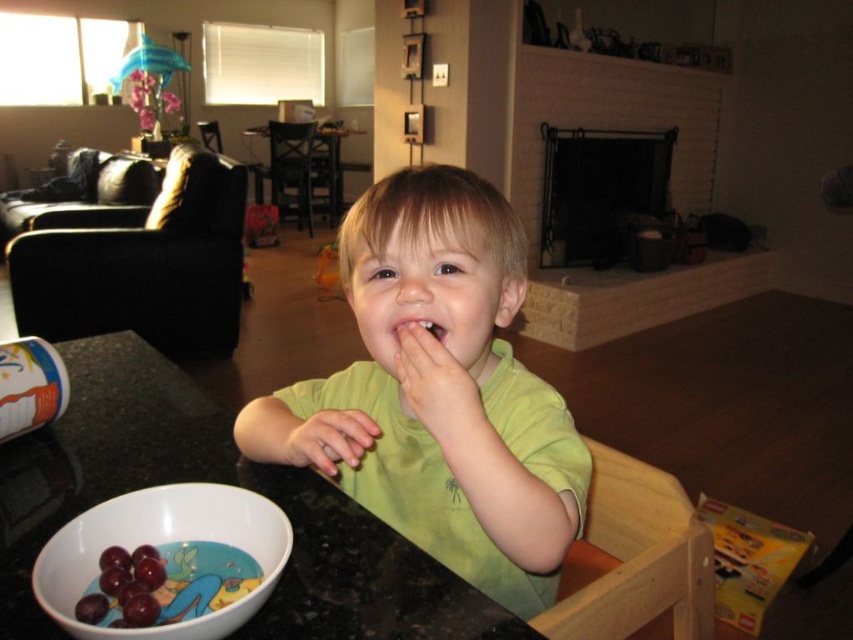
Question: Can you confirm if black granite table at lower left is positioned below smooth skin at mouth right?

Choices:
 (A) no
 (B) yes

Answer: (B)

Question: Which point is closer to the camera?

Choices:
 (A) black granite table at lower left
 (B) black fabric couch at left
 (C) smooth skin at mouth right
 (D) green matte shirt at center

Answer: (A)

Question: Which is farther from the black fabric couch at left?

Choices:
 (A) green matte shirt at center
 (B) black granite table at lower left
 (C) wooden table at center
 (D) smooth skin at mouth right

Answer: (C)

Question: Which point is closer to the camera taking this photo?

Choices:
 (A) (103, 598)
 (B) (471, 368)
 (C) (357, 580)

Answer: (A)

Question: Can you confirm if black fabric couch at left is positioned above wooden table at center?

Choices:
 (A) yes
 (B) no

Answer: (B)

Question: Is green matte shirt at center closer to the viewer compared to matte white bowl at lower left?

Choices:
 (A) yes
 (B) no

Answer: (B)